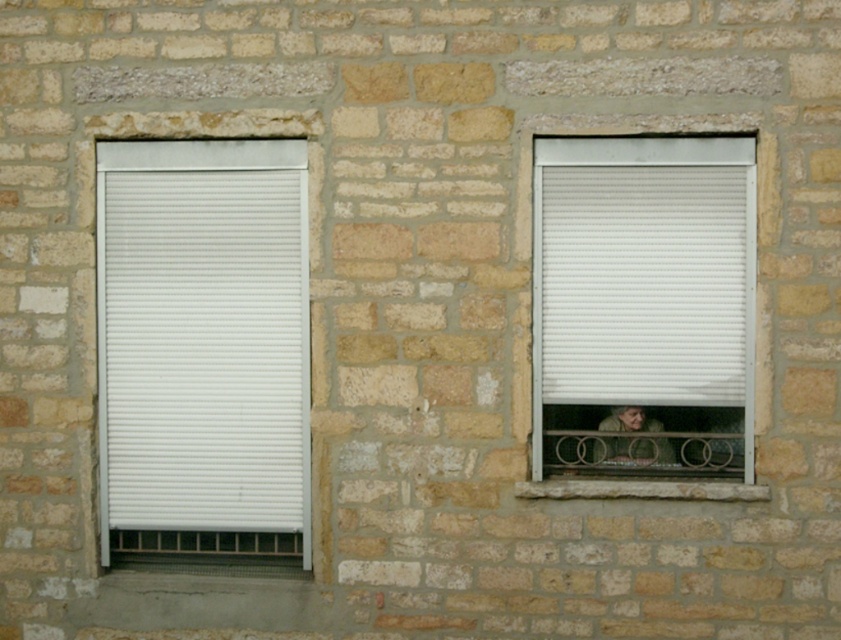
Question: Which of the following is the closest to the observer?

Choices:
 (A) (194, 392)
 (B) (638, 424)

Answer: (B)

Question: Among these objects, which one is farthest from the camera?

Choices:
 (A) white plastic window at right
 (B) white matte blind at left
 (C) light brown leather jacket at lower right

Answer: (C)

Question: Does white plastic window at right appear on the right side of white matte blind at left?

Choices:
 (A) yes
 (B) no

Answer: (A)

Question: Which of the following is the closest to the observer?

Choices:
 (A) light brown leather jacket at lower right
 (B) white plastic window at right
 (C) white matte blind at left

Answer: (B)

Question: Does white matte blind at left have a greater width compared to light brown leather jacket at lower right?

Choices:
 (A) yes
 (B) no

Answer: (A)

Question: Is white plastic window at right positioned in front of white matte blind at left?

Choices:
 (A) no
 (B) yes

Answer: (B)